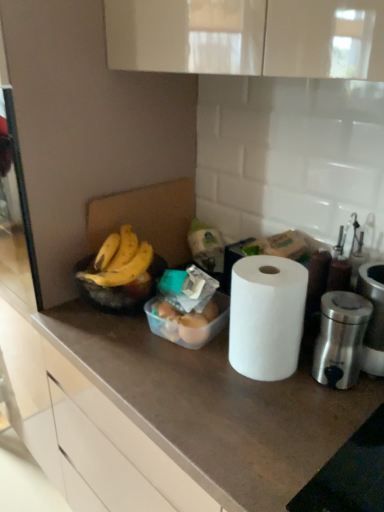
Question: Is polished stainless steel appliance at right situated inside white matte countertop at center or outside?

Choices:
 (A) outside
 (B) inside

Answer: (A)

Question: In the image, is polished stainless steel appliance at right positioned in front of or behind white matte countertop at center?

Choices:
 (A) front
 (B) behind

Answer: (B)

Question: Considering the real-world distances, which object is closest to the white matte countertop at center?

Choices:
 (A) translucent plastic eggs at center
 (B) yellow matte bananas at left
 (C) white matte paper towel at center
 (D) polished stainless steel appliance at right
 (E) black plastic bowl at left

Answer: (A)

Question: Estimate the real-world distances between objects in this image. Which object is closer to the polished stainless steel appliance at right?

Choices:
 (A) black plastic bowl at left
 (B) white matte countertop at center
 (C) translucent plastic eggs at center
 (D) yellow matte bananas at left
 (E) white matte paper towel at center

Answer: (E)